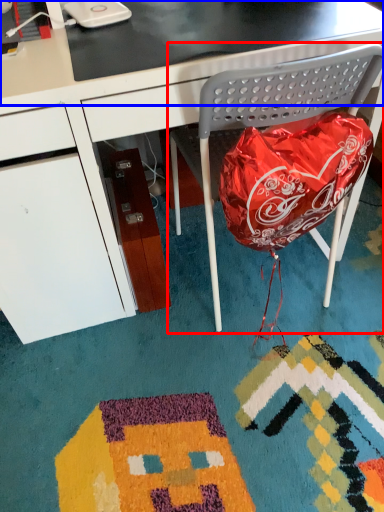
Question: Which point is closer to the camera, folding chair (highlighted by a red box) or table top (highlighted by a blue box)?

Choices:
 (A) folding chair
 (B) table top

Answer: (A)